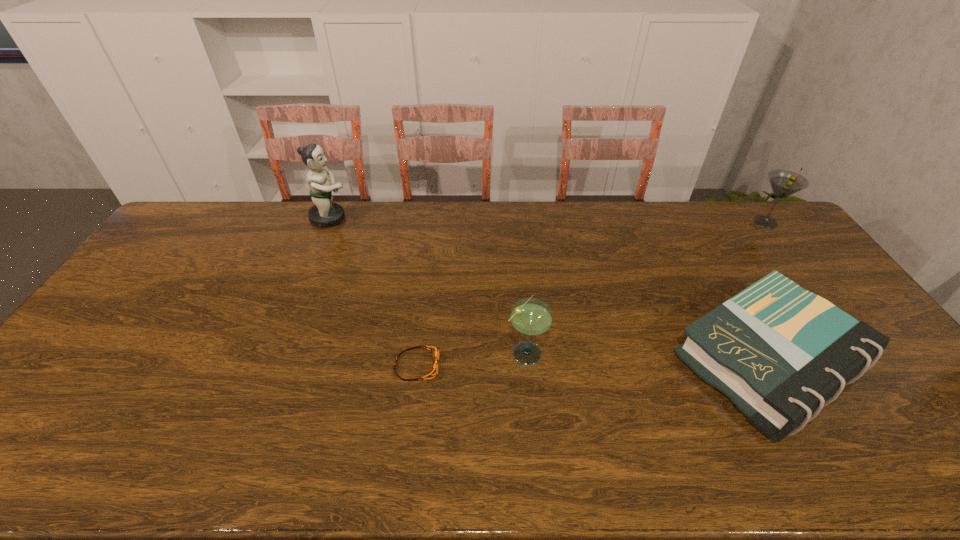
Locate an element on the screen. The image size is (960, 540). object located at the near right corner is located at coordinates (781, 353).

The height and width of the screenshot is (540, 960). In order to click on vacant space at the far edge of the desktop in this screenshot , I will do `click(618, 229)`.

In the image, there is a desktop. Where is `vacant space at the right edge`? This screenshot has height=540, width=960. vacant space at the right edge is located at coordinates (773, 258).

Where is `vacant space at the far left corner of the desktop`? vacant space at the far left corner of the desktop is located at coordinates (208, 228).

At what (x,y) coordinates should I click in order to perform the action: click on vacant space at the far right corner. Please return your answer as a coordinate pair (x, y). Image resolution: width=960 pixels, height=540 pixels. Looking at the image, I should click on (737, 215).

Identify the location of unoccupied position between the goggles and the nearer martini. Image resolution: width=960 pixels, height=540 pixels. (471, 359).

Find the location of a particular element. vacant area that lies between the second object from left to right and the paperback book is located at coordinates (592, 364).

Locate an element on the screen. vacant region between the leftmost object and the second object from left to right is located at coordinates (373, 292).

Find the location of a particular element. The width and height of the screenshot is (960, 540). vacant space that's between the shortest object and the leftmost object is located at coordinates (373, 292).

Where is `blank region between the goggles and the nearer martini`? This screenshot has width=960, height=540. blank region between the goggles and the nearer martini is located at coordinates (471, 359).